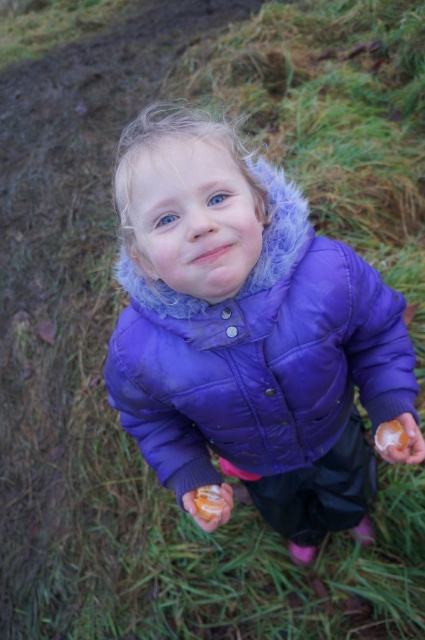
You are a photographer trying to capture the matte orange donut at center and the orange matte donut at center in a single shot. Which one will appear closer to the camera in the photo?

The matte orange donut at center will appear closer to the camera because it is further to the viewer than the orange matte donut at center.

You are a photographer setting up a shot of the child in the scene. The purple puffy jacket at center and the matte orange donut at center are both in the frame. Which object appears larger in the photo?

The purple puffy jacket at center appears larger than the matte orange donut at center because it is taller.